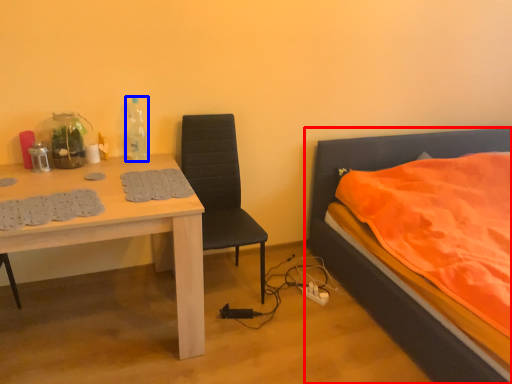
Question: Which object appears closest to the camera in this image, bed (highlighted by a red box) or bottle (highlighted by a blue box)?

Choices:
 (A) bed
 (B) bottle

Answer: (A)